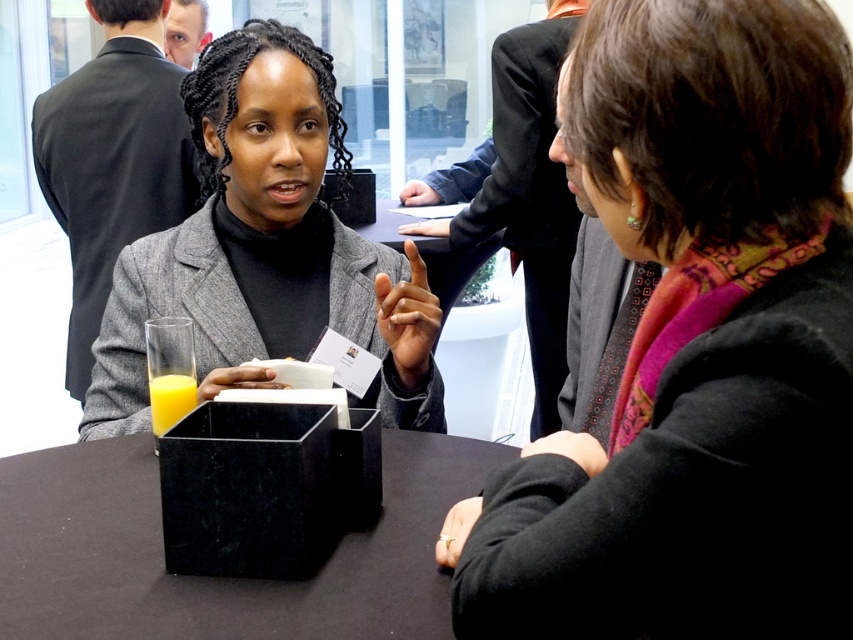
Question: Which of the following is the closest to the observer?

Choices:
 (A) matte black napkin at center
 (B) matte black jacket at center
 (C) matte black hand at center

Answer: (B)

Question: Which point is closer to the camera taking this photo?

Choices:
 (A) (430, 188)
 (B) (224, 449)

Answer: (B)

Question: Is black marble organizer at center positioned behind translucent glass at lower left?

Choices:
 (A) no
 (B) yes

Answer: (A)

Question: In this image, where is gold metallic ring at lower center located relative to matte black napkin at center?

Choices:
 (A) left
 (B) right

Answer: (B)

Question: Among these points, which one is nearest to the camera?

Choices:
 (A) (206, 600)
 (B) (277, 436)

Answer: (A)

Question: Does gold metallic ring at lower center have a larger size compared to matte black hand at upper center?

Choices:
 (A) no
 (B) yes

Answer: (A)